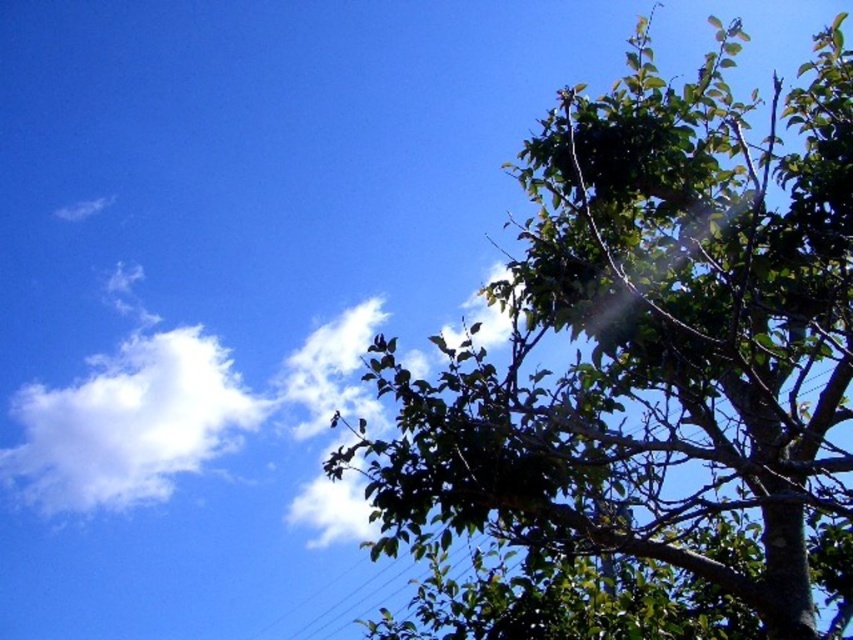
Question: Which point is closer to the camera taking this photo?

Choices:
 (A) (148, 499)
 (B) (311, 621)
 (C) (537, 419)

Answer: (C)

Question: In this image, where is white fluffy cloud at upper left located relative to black wire at upper center?

Choices:
 (A) below
 (B) above

Answer: (B)

Question: Which object is the closest to the green leafy tree at upper right?

Choices:
 (A) white fluffy cloud at upper left
 (B) black wire at upper center

Answer: (B)

Question: Where is green leafy tree at upper right located in relation to white fluffy cloud at upper left in the image?

Choices:
 (A) left
 (B) right

Answer: (B)

Question: Can you confirm if green leafy tree at upper right is wider than black wire at upper center?

Choices:
 (A) yes
 (B) no

Answer: (A)

Question: Which point is farther to the camera?

Choices:
 (A) white fluffy cloud at upper left
 (B) black wire at upper center

Answer: (A)